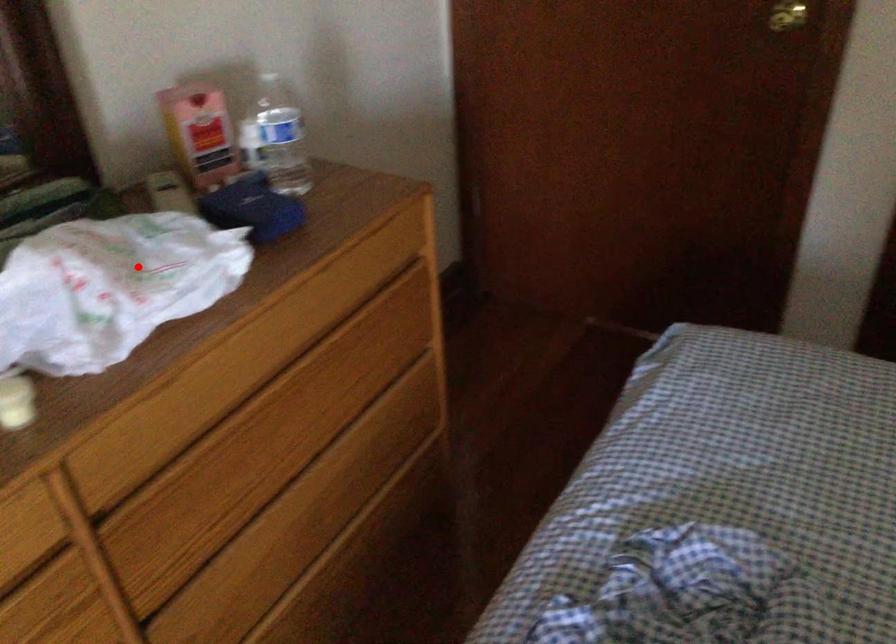
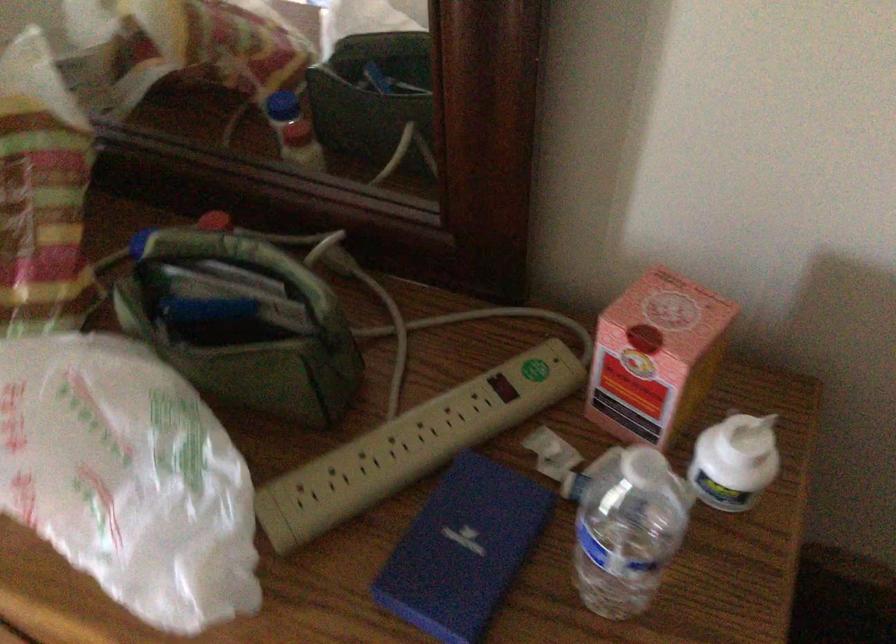
Where in the second image is the point corresponding to the highlighted location from the first image?

(126, 478)